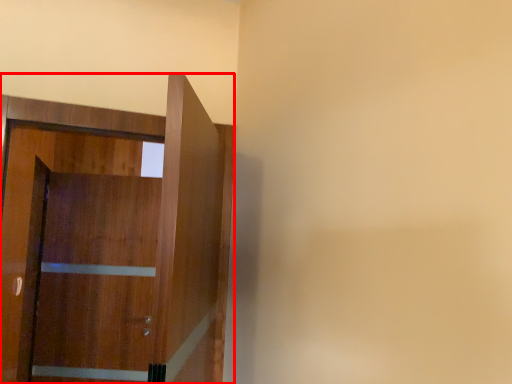
Question: In this image, where is door (annotated by the red box) located relative to barn door?

Choices:
 (A) left
 (B) right

Answer: (B)